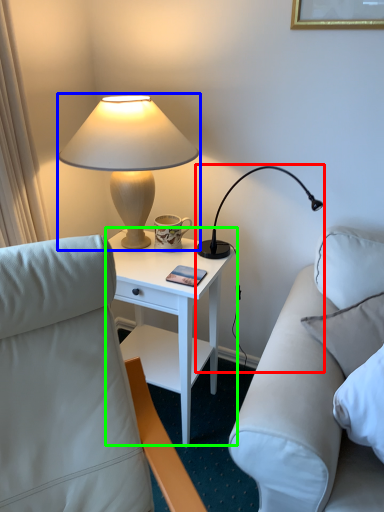
Question: Considering the real-world distances, which object is farthest from lamp (highlighted by a red box)? lamp (highlighted by a blue box) or nightstand (highlighted by a green box)?

Choices:
 (A) lamp
 (B) nightstand

Answer: (A)